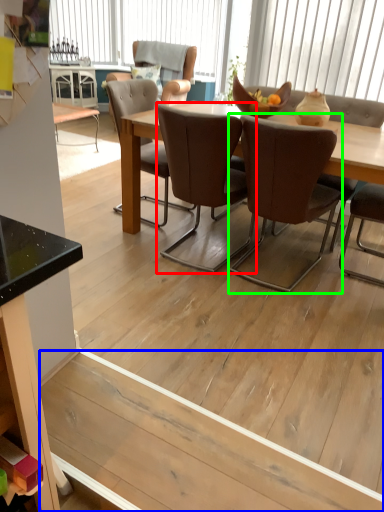
Question: Based on their relative distances, which object is nearer to chair (highlighted by a red box)? Choose from plywood (highlighted by a blue box) and chair (highlighted by a green box).

Choices:
 (A) plywood
 (B) chair

Answer: (B)